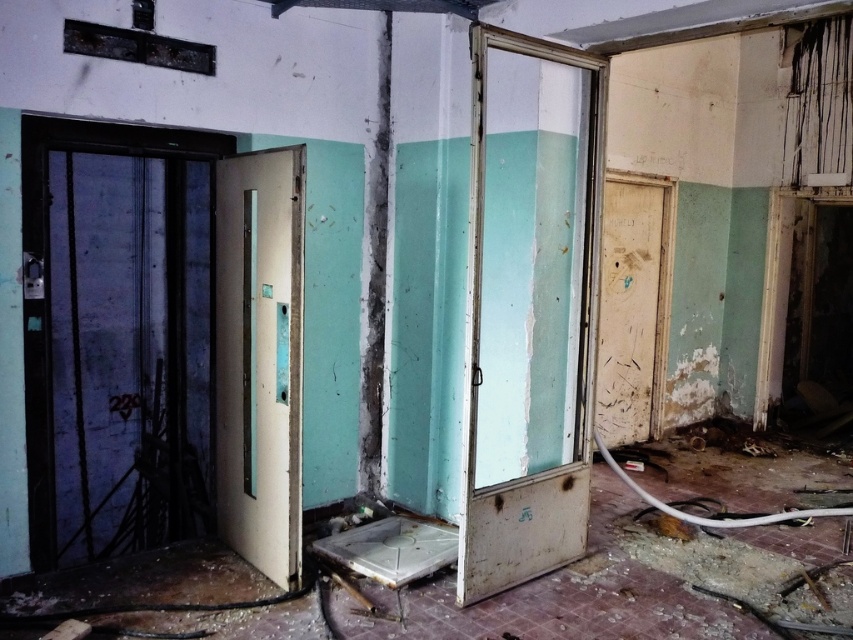
Question: Which object appears closest to the camera in this image?

Choices:
 (A) worn wood door at right
 (B) white matte door at center
 (C) peeling paint door at center

Answer: (C)

Question: Does peeling paint door at center have a greater width compared to worn wood door at right?

Choices:
 (A) no
 (B) yes

Answer: (A)

Question: Which point is closer to the camera?

Choices:
 (A) white matte door at center
 (B) peeling paint door at center

Answer: (B)

Question: Among these points, which one is nearest to the camera?

Choices:
 (A) (608, 170)
 (B) (233, 419)

Answer: (B)

Question: Is white matte door at center positioned at the back of worn wood door at right?

Choices:
 (A) no
 (B) yes

Answer: (A)

Question: Where is peeling paint door at center located in relation to worn wood door at right in the image?

Choices:
 (A) right
 (B) left

Answer: (B)